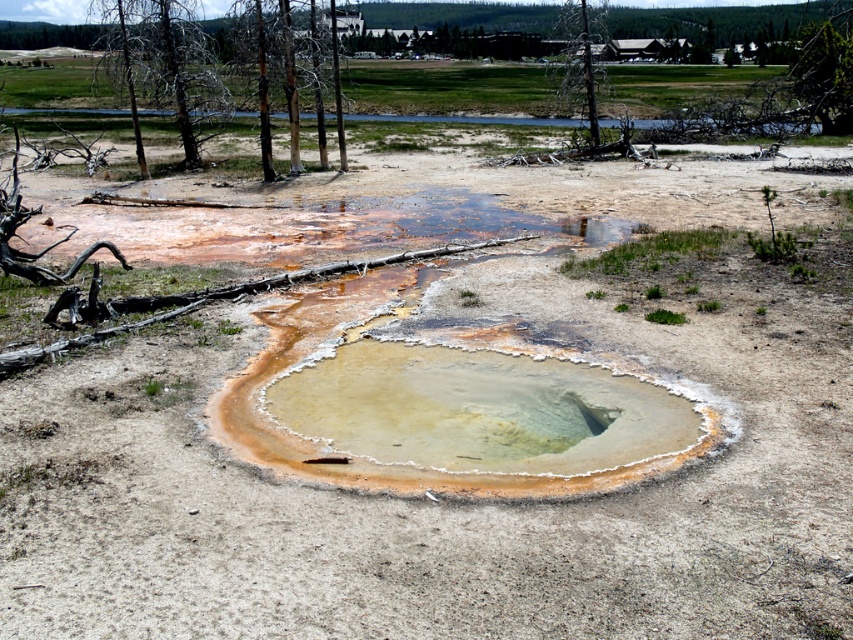
Can you confirm if brown bark tree at upper left is shorter than brown bark tree at upper center?

No, brown bark tree at upper left is not shorter than brown bark tree at upper center.

Does brown bark tree at upper left have a greater height compared to brown bark tree at upper center?

Correct, brown bark tree at upper left is much taller as brown bark tree at upper center.

Does point (105, 44) lie behind point (567, 22)?

Yes, point (105, 44) is behind point (567, 22).

This screenshot has height=640, width=853. Identify the location of brown bark tree at upper left. (161, 65).

Is brown bark tree at upper left in front of green leafy tree at upper right?

Yes.

Which is below, brown bark tree at upper left or green leafy tree at upper right?

green leafy tree at upper right

Which is in front, point (164, 22) or point (825, 38)?

Positioned in front is point (164, 22).

Where is `brown bark tree at upper left`? brown bark tree at upper left is located at coordinates (161, 65).

Does brown bark tree at upper center have a smaller size compared to green leafy tree at upper right?

Actually, brown bark tree at upper center might be larger than green leafy tree at upper right.

Who is positioned more to the right, brown bark tree at upper center or green leafy tree at upper right?

From the viewer's perspective, green leafy tree at upper right appears more on the right side.

Does point (550, 76) come farther from viewer compared to point (805, 49)?

That is True.

Where is `brown bark tree at upper center`? Image resolution: width=853 pixels, height=640 pixels. brown bark tree at upper center is located at coordinates (581, 60).